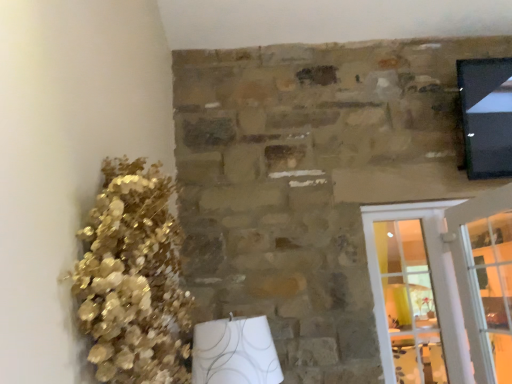
Question: Considering their positions, is gold metallic floral arrangement at left located in front of or behind white glass screen door at right?

Choices:
 (A) behind
 (B) front

Answer: (B)

Question: Is gold metallic floral arrangement at left inside the boundaries of white glass screen door at right, or outside?

Choices:
 (A) outside
 (B) inside

Answer: (A)

Question: Estimate the real-world distances between objects in this image. Which object is closer to the clear glass door at lower right?

Choices:
 (A) gold metallic floral arrangement at left
 (B) white glass screen door at right

Answer: (B)

Question: Which of these objects is positioned farthest from the gold metallic floral arrangement at left?

Choices:
 (A) white glass screen door at right
 (B) clear glass door at lower right

Answer: (B)